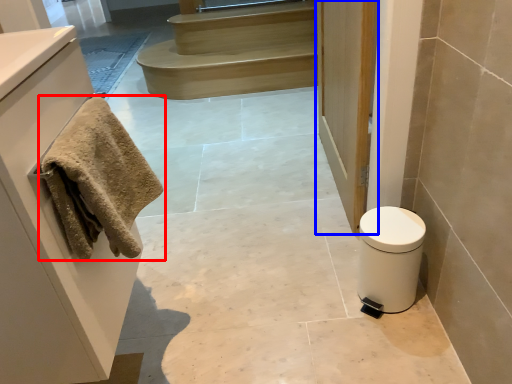
Question: Which point is further to the camera, towel (highlighted by a red box) or door (highlighted by a blue box)?

Choices:
 (A) towel
 (B) door

Answer: (B)